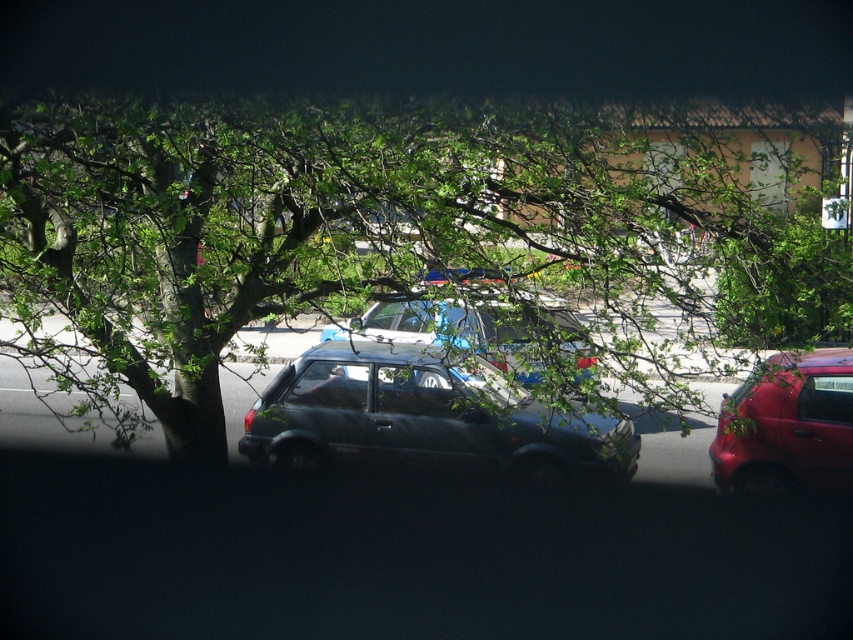
Between shiny black minivan at center and shiny red car at right, which one is positioned lower?

shiny red car at right is below.

Is point (502, 394) positioned in front of point (737, 468)?

Yes, it is.

At what (x,y) coordinates should I click in order to perform the action: click on shiny black minivan at center. Please return your answer as a coordinate pair (x, y). The height and width of the screenshot is (640, 853). Looking at the image, I should click on (425, 417).

Does shiny black minivan at center lie in front of white plastic license plate at center?

Yes.

Can you confirm if shiny black minivan at center is shorter than white plastic license plate at center?

No.

What do you see at coordinates (425, 417) in the screenshot?
I see `shiny black minivan at center` at bounding box center [425, 417].

Locate an element on the screen. Image resolution: width=853 pixels, height=640 pixels. shiny black minivan at center is located at coordinates (425, 417).

I want to click on green leafy tree at center, so click(x=404, y=241).

Identify the location of green leafy tree at center. This screenshot has height=640, width=853. click(x=404, y=241).